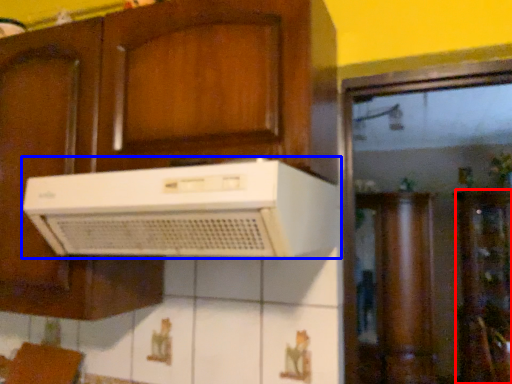
Question: Among these objects, which one is nearest to the camera, cabinetry (highlighted by a red box) or home appliance (highlighted by a blue box)?

Choices:
 (A) cabinetry
 (B) home appliance

Answer: (B)